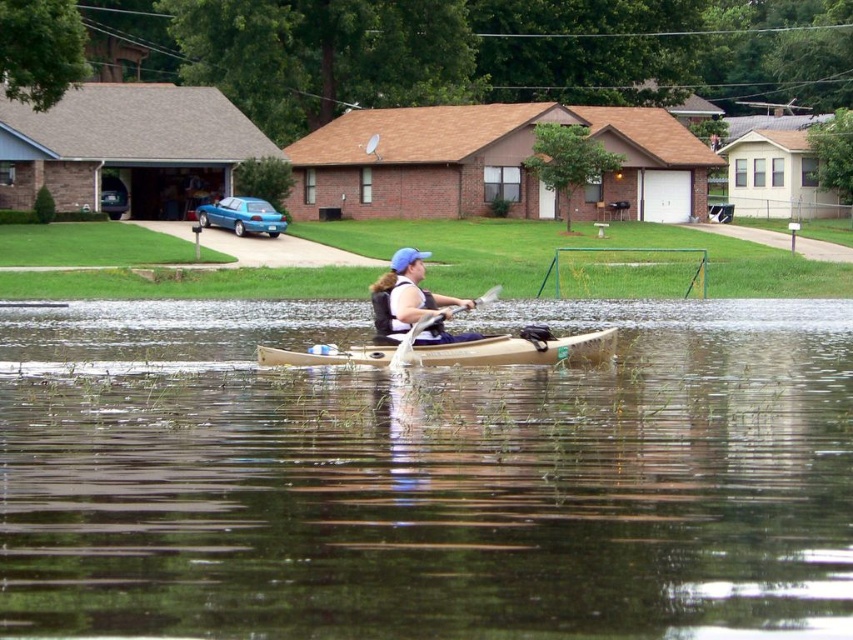
You are a rescue worker in a flooded area. You need to determine if the wooden paddle at center can be fully submerged in the brown matte water at center. Can it fit?

The brown matte water at center is larger in size than wooden paddle at center, so yes, the wooden paddle at center can be fully submerged in the brown matte water at center.

You are a rescue worker in a flooded area. You see a brown matte water at center and a matte blue life vest at center. Which object takes up more space in the image?

The brown matte water at center is larger in size than the matte blue life vest at center, so it takes up more space in the image.

You are a drone operator trying to capture the flooded area. The brown matte water at center is at point (x=425, y=477). Where should you direct your camera to focus on the brown matte water at center?

The brown matte water at center is located at point (x=425, y=477), so you should direct your camera to focus on that coordinate.